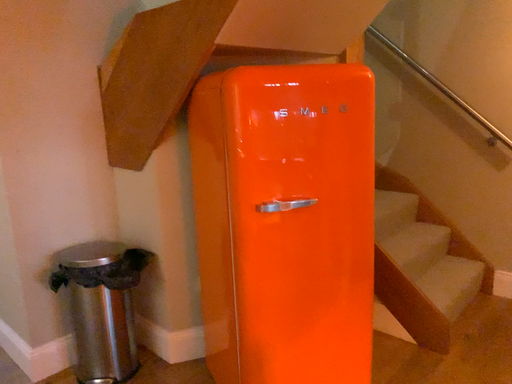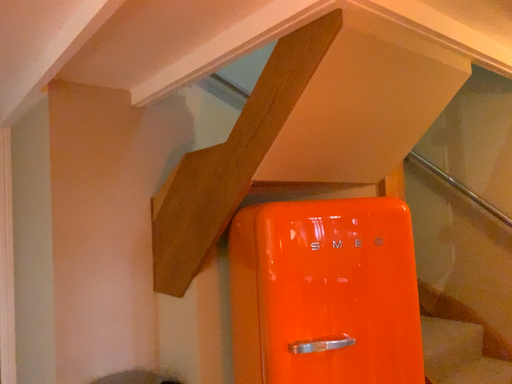
Question: How did the camera likely rotate when shooting the video?

Choices:
 (A) rotated left
 (B) rotated right

Answer: (A)